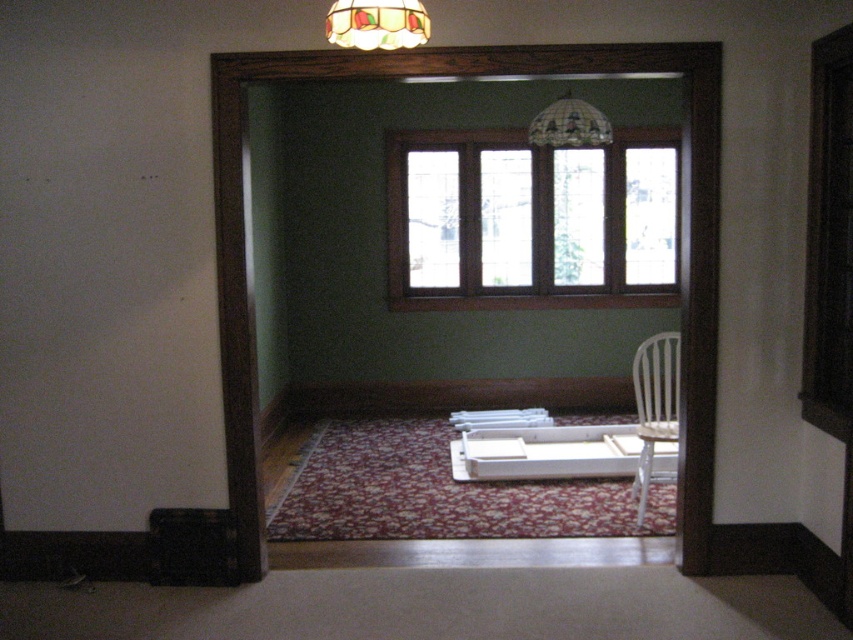
You are standing in a room with a vintage style. You notice a clear glass window at center and a stained glass lampshade at upper center. Which object is higher up in the room?

The stained glass lampshade at upper center is higher up in the room because it is positioned above the clear glass window at center.

You are a painter who needs to set up an easel that requires 2 meters of vertical space. You see the white plastic chair at center and the stained glass dome at upper center. Which object is taller and can accommodate your easel?

The white plastic chair at center is taller than the stained glass dome at upper center. Since the easel requires 2 meters of vertical space, you need to check the height of the white plastic chair at center to ensure it doesn doesn

You are moving a large painting that is 1.2 meters wide. You want to hang it on the wall where the clear glass window at center and the white plastic chair at center are located. Which object should you avoid placing the painting next to to ensure there is enough space?

You should avoid placing the painting next to the clear glass window at center because it occupies less space than the white plastic chair at center, leaving less room for the painting.